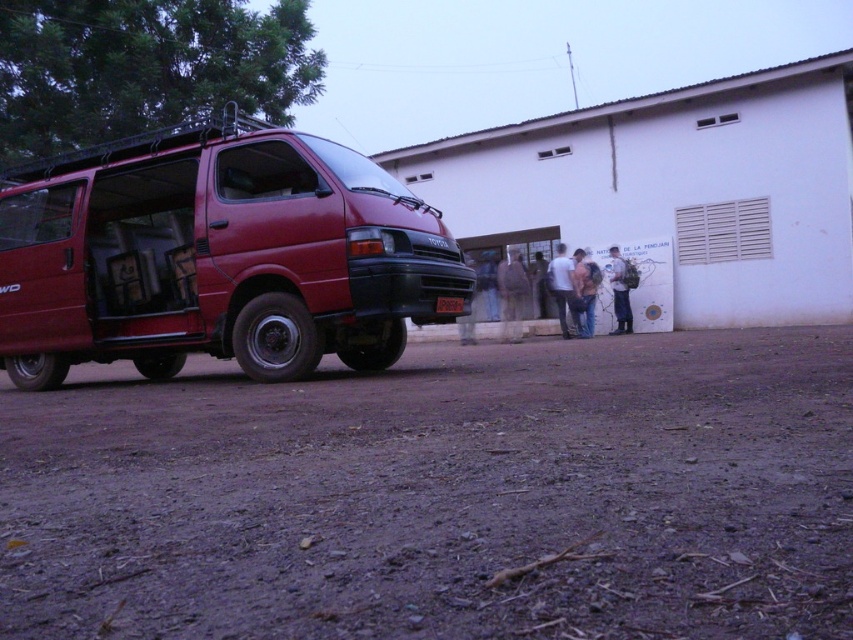
Which is behind, point (830, 632) or point (111, 227)?

The point (111, 227) is behind.

Based on the photo, can you confirm if dusty brown dirt at lower center is wider than matte red van at left?

Correct, the width of dusty brown dirt at lower center exceeds that of matte red van at left.

Is point (827, 436) more distant than point (206, 212)?

No.

Locate an element on the screen. Image resolution: width=853 pixels, height=640 pixels. dusty brown dirt at lower center is located at coordinates (440, 493).